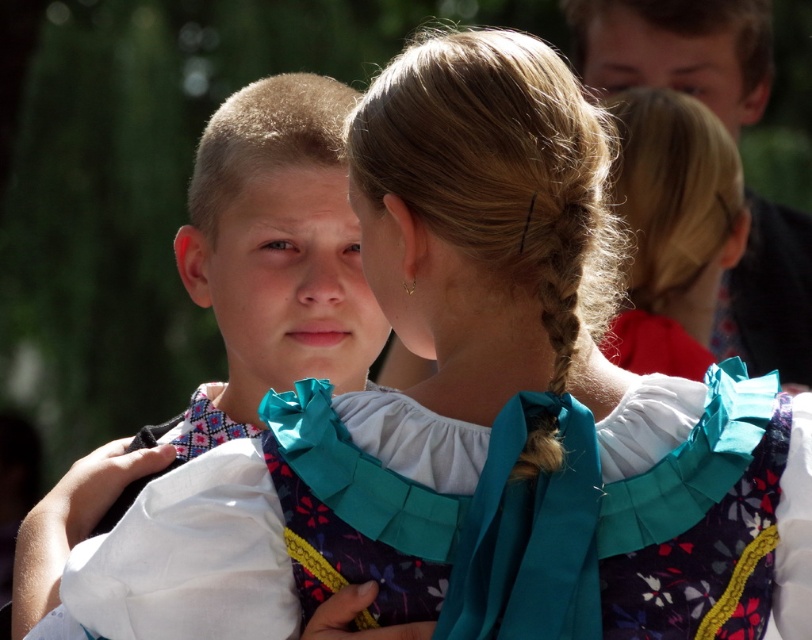
Question: Is floral fabric dress at center positioned before blonde hair at upper center?

Choices:
 (A) no
 (B) yes

Answer: (B)

Question: Considering the real-world distances, which object is farthest from the blonde hair at upper center?

Choices:
 (A) matte white shirt at center
 (B) teal satin ribbon at center
 (C) floral fabric dress at center

Answer: (C)

Question: Which object appears farthest from the camera in this image?

Choices:
 (A) teal satin ribbon at center
 (B) floral fabric dress at center
 (C) matte white shirt at center

Answer: (A)

Question: Is the position of matte white shirt at center less distant than that of blonde hair at upper center?

Choices:
 (A) yes
 (B) no

Answer: (A)

Question: Can you confirm if teal satin ribbon at center is positioned above blonde hair at upper center?

Choices:
 (A) yes
 (B) no

Answer: (A)

Question: Among these points, which one is nearest to the camera?

Choices:
 (A) (784, 257)
 (B) (184, 586)
 (C) (222, 289)
 (D) (664, 148)

Answer: (B)